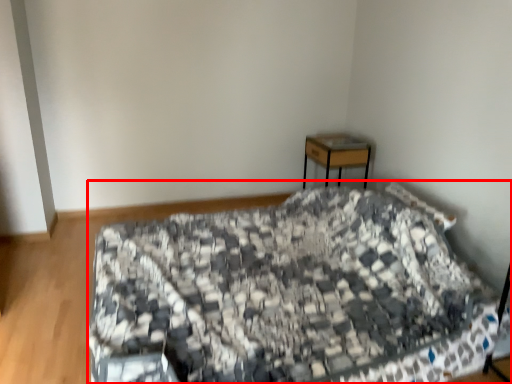
Question: Where is bed (annotated by the red box) located in relation to desk in the image?

Choices:
 (A) right
 (B) left

Answer: (B)